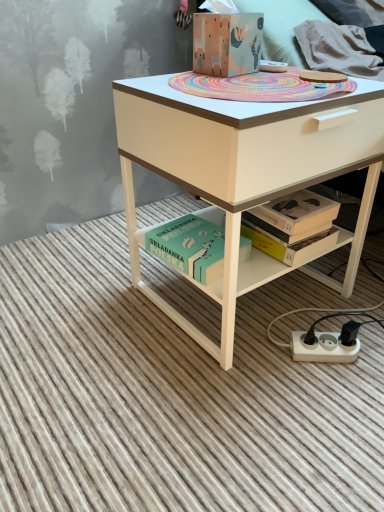
The width and height of the screenshot is (384, 512). I want to click on vacant area to the left of white plastic power plugs and sockets at lower right, so click(x=251, y=358).